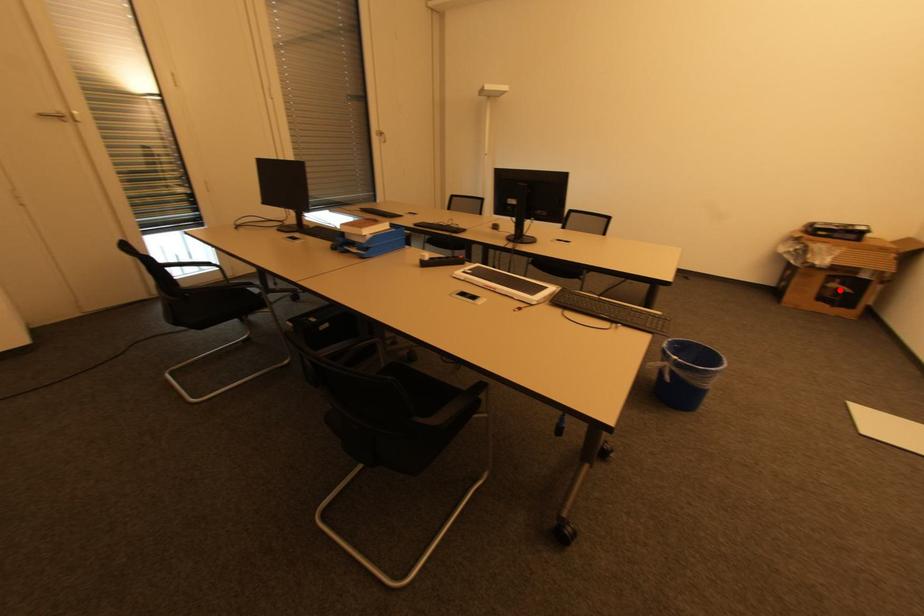
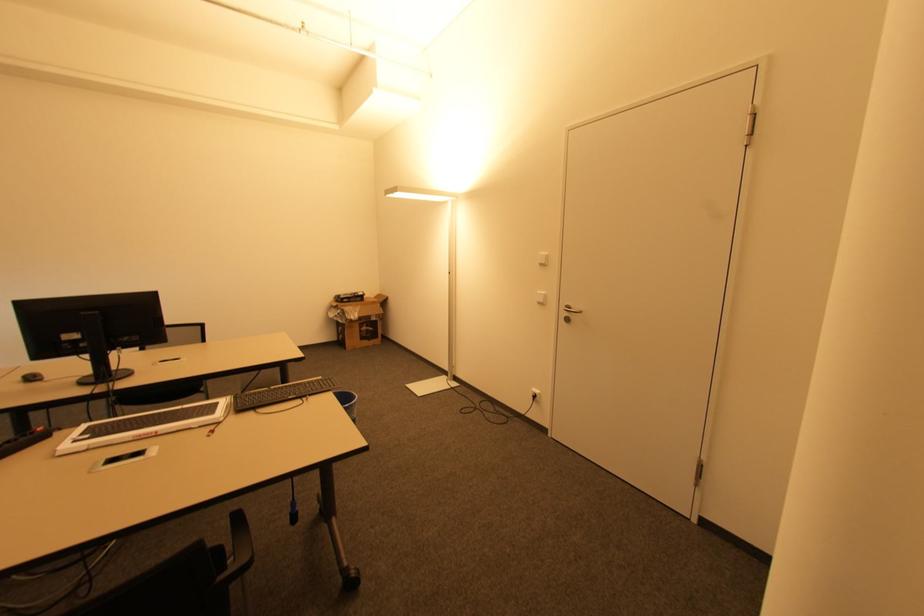
Locate, in the second image, the point that corresponds to the highlighted location in the first image.

(369, 331)